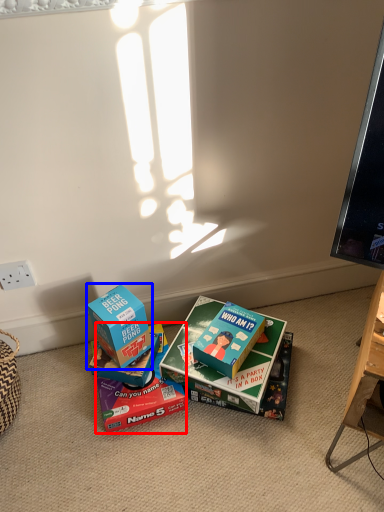
Question: Which object is further to the camera taking this photo, box (highlighted by a red box) or box (highlighted by a blue box)?

Choices:
 (A) box
 (B) box

Answer: (A)